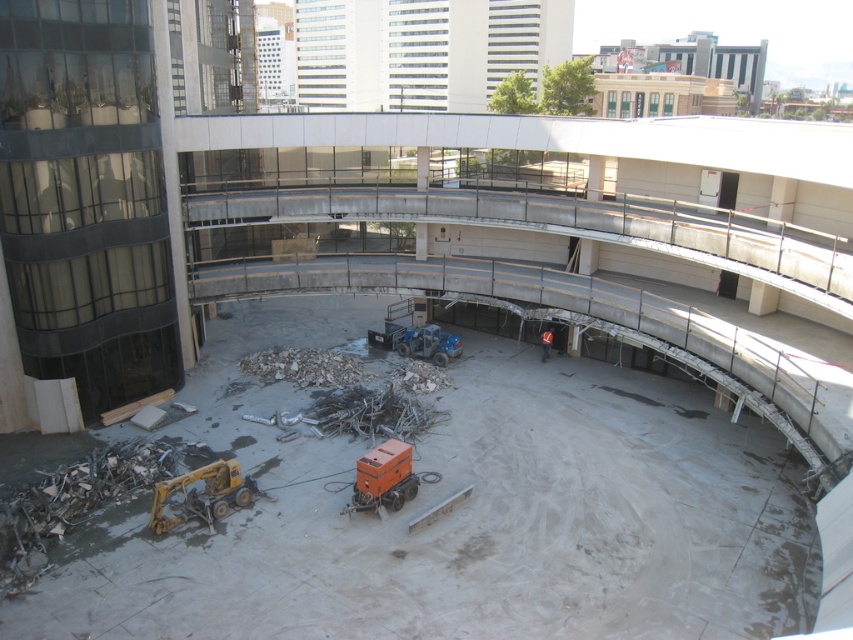
Question: Can you confirm if yellow metallic excavator at lower left is thinner than blue metallic forklift at center?

Choices:
 (A) no
 (B) yes

Answer: (B)

Question: Which point is closer to the camera?

Choices:
 (A) (438, 332)
 (B) (544, 358)
 (C) (375, 506)

Answer: (C)

Question: Considering the real-world distances, which object is closest to the orange metallic generator at center?

Choices:
 (A) blue metallic forklift at center
 (B) yellow metallic excavator at lower left

Answer: (B)

Question: Considering the real-world distances, which object is closest to the blue metallic forklift at center?

Choices:
 (A) orange metallic generator at center
 (B) orange reflective vest at center
 (C) yellow metallic excavator at lower left

Answer: (B)

Question: Is orange metallic generator at center thinner than blue metallic forklift at center?

Choices:
 (A) yes
 (B) no

Answer: (A)

Question: Does blue metallic forklift at center have a smaller size compared to orange reflective vest at center?

Choices:
 (A) no
 (B) yes

Answer: (A)